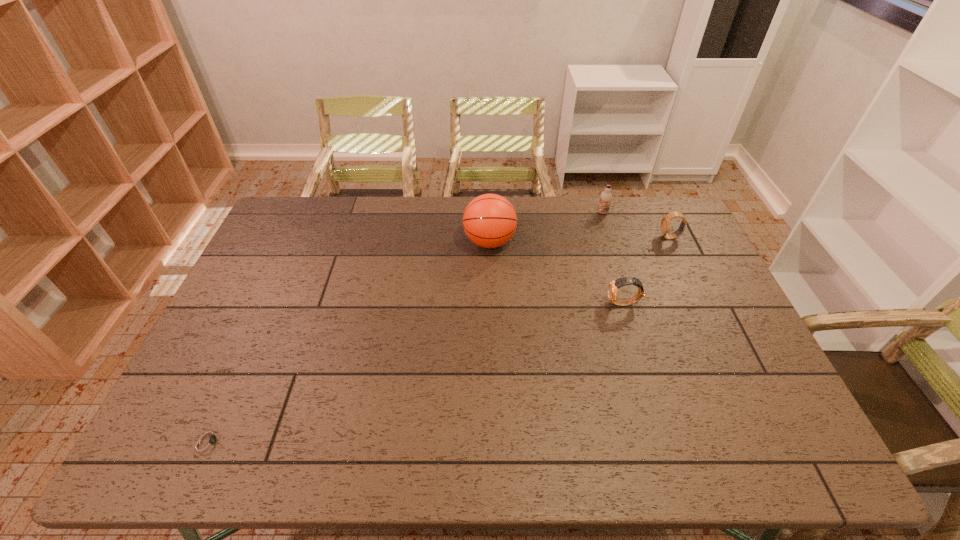
Locate an element on the screen. Image resolution: width=960 pixels, height=540 pixels. blank region between the farthest object and the second nearest object is located at coordinates (612, 258).

The image size is (960, 540). I want to click on object that can be found as the second closest to the basketball, so click(x=606, y=197).

This screenshot has width=960, height=540. Identify the location of object that is the third closest to the fourth object from right to left. (665, 226).

Locate which watch ranks second in proximity to the second object from left to right. Please provide its 2D coordinates. Your answer should be formatted as a tuple, i.e. [(x, y)], where the tuple contains the x and y coordinates of a point satisfying the conditions above.

[(665, 226)]

Locate which watch is the closest to the second farthest watch. Please provide its 2D coordinates. Your answer should be formatted as a tuple, i.e. [(x, y)], where the tuple contains the x and y coordinates of a point satisfying the conditions above.

[(665, 226)]